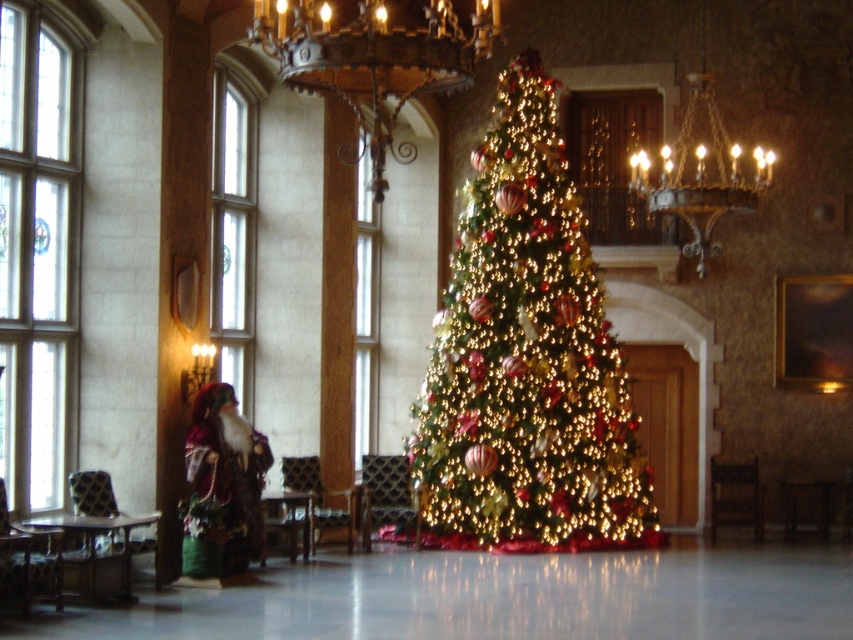
Question: Can you confirm if iridescent gold christmas tree at center is positioned above velvet plush santa at left?

Choices:
 (A) no
 (B) yes

Answer: (B)

Question: Is dark brown wrought iron chandelier at upper center to the right of velvet plush santa at left from the viewer's perspective?

Choices:
 (A) yes
 (B) no

Answer: (A)

Question: Which point is farther from the camera taking this photo?

Choices:
 (A) (215, 545)
 (B) (569, 458)

Answer: (B)

Question: Among these objects, which one is farthest from the camera?

Choices:
 (A) iridescent gold christmas tree at center
 (B) velvet plush santa at left

Answer: (A)

Question: Which object is closer to the camera taking this photo?

Choices:
 (A) dark brown wrought iron chandelier at upper center
 (B) iridescent gold christmas tree at center

Answer: (A)

Question: Is dark brown wrought iron chandelier at upper center thinner than velvet plush santa at left?

Choices:
 (A) yes
 (B) no

Answer: (B)